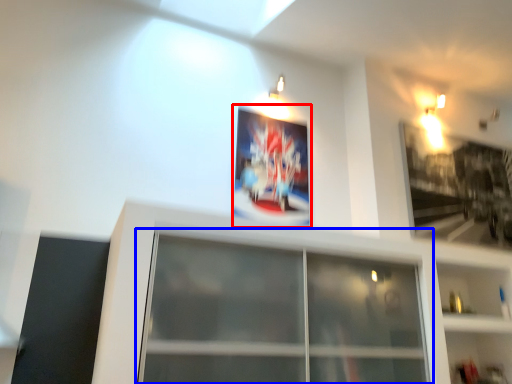
Question: Which object appears closest to the camera in this image, picture frame (highlighted by a red box) or window (highlighted by a blue box)?

Choices:
 (A) picture frame
 (B) window

Answer: (B)